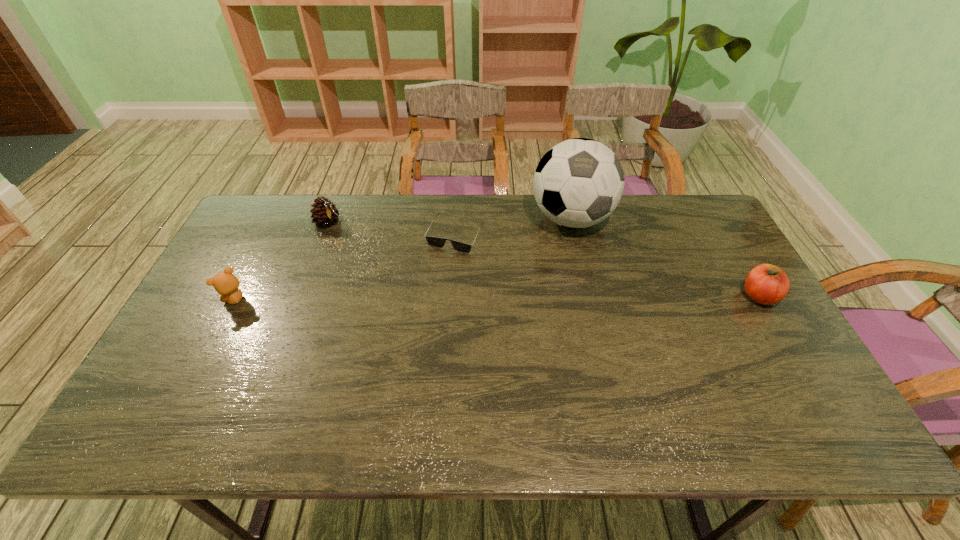
In order to click on free space located 0.050m on the front-facing side of the sunglasses in this screenshot , I will do `click(441, 264)`.

Find the location of a particular element. Image resolution: width=960 pixels, height=540 pixels. blank space located with a leaf charm attached to the second object from left to right is located at coordinates (399, 273).

This screenshot has height=540, width=960. What are the coordinates of `free space located with a leaf charm attached to the second object from left to right` in the screenshot? It's located at (356, 240).

Where is `vacant space located 0.290m with a leaf charm attached to the second object from left to right`? This screenshot has width=960, height=540. vacant space located 0.290m with a leaf charm attached to the second object from left to right is located at coordinates (396, 270).

You are a GUI agent. You are given a task and a screenshot of the screen. Output one action in this format:
    pyautogui.click(x=<x>, y=<y>)
    Task: Click on the free spot located 0.380m on the main logo of the second object from right to left
    This screenshot has width=960, height=540.
    Given the screenshot: What is the action you would take?
    pyautogui.click(x=563, y=343)

Where is `vacant area located on the main logo of the second object from right to left`? This screenshot has height=540, width=960. vacant area located on the main logo of the second object from right to left is located at coordinates (563, 346).

Locate an element on the screen. free space located on the main logo of the second object from right to left is located at coordinates (564, 319).

The width and height of the screenshot is (960, 540). What are the coordinates of `sunglasses that is at the far edge` in the screenshot? It's located at (436, 242).

This screenshot has height=540, width=960. Identify the location of pinecone that is at the far edge. (325, 213).

You are a GUI agent. You are given a task and a screenshot of the screen. Output one action in this format:
    pyautogui.click(x=<x>, y=<y>)
    Task: Click on the soccer ball located at the far edge
    Image resolution: width=960 pixels, height=540 pixels.
    Given the screenshot: What is the action you would take?
    pyautogui.click(x=578, y=183)